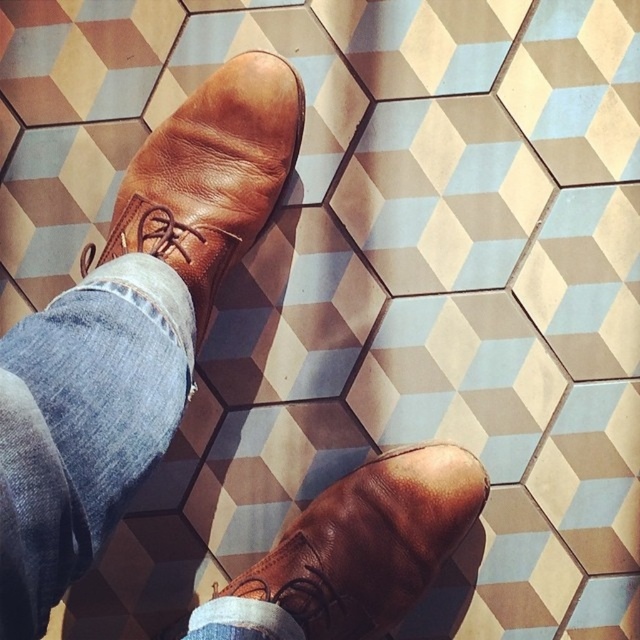
You are standing on the geometrically patterned floor with hexagonal tiles. You notice a point marked at coordinates (440, 195). Which hexagonal tile color is located at that point?

The point at coordinates (440, 195) corresponds to the light blue textured tile at center.

You are an interior designer assessing the placement of furniture in this room. You notice the brown leather shoe at upper left and the brown leather shoe at lower right. Which shoe takes up more area on the floor?

The brown leather shoe at lower right takes up more area on the floor than the brown leather shoe at upper left because it occupies less space.